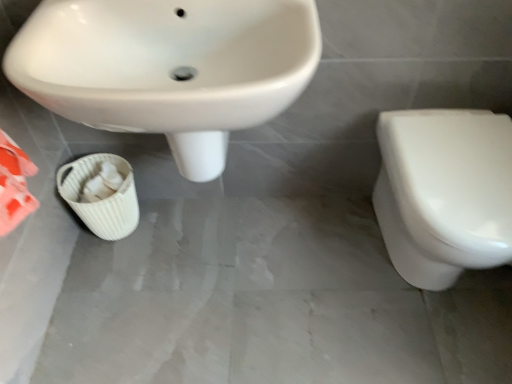
Question: Is white glossy toilet at right oriented towards white woven basket at lower left?

Choices:
 (A) no
 (B) yes

Answer: (A)

Question: Considering the relative positions of white glossy toilet at right and white woven basket at lower left in the image provided, is white glossy toilet at right to the right of white woven basket at lower left from the viewer's perspective?

Choices:
 (A) no
 (B) yes

Answer: (B)

Question: From the image's perspective, is white glossy toilet at right on top of white woven basket at lower left?

Choices:
 (A) yes
 (B) no

Answer: (B)

Question: Is white glossy toilet at right surrounding white woven basket at lower left?

Choices:
 (A) yes
 (B) no

Answer: (B)

Question: Is the surface of white glossy toilet at right in direct contact with white woven basket at lower left?

Choices:
 (A) yes
 (B) no

Answer: (B)

Question: Can you confirm if white glossy toilet at right is taller than white woven basket at lower left?

Choices:
 (A) no
 (B) yes

Answer: (B)

Question: Considering the relative positions of white woven basket at lower left and white glossy toilet at right in the image provided, is white woven basket at lower left to the left of white glossy toilet at right from the viewer's perspective?

Choices:
 (A) yes
 (B) no

Answer: (A)

Question: From the image's perspective, is white woven basket at lower left located above white glossy toilet at right?

Choices:
 (A) no
 (B) yes

Answer: (B)

Question: Does white woven basket at lower left have a greater height compared to white glossy toilet at right?

Choices:
 (A) yes
 (B) no

Answer: (B)

Question: Are white woven basket at lower left and white glossy toilet at right far apart?

Choices:
 (A) no
 (B) yes

Answer: (A)

Question: Can we say white woven basket at lower left lies outside white glossy toilet at right?

Choices:
 (A) yes
 (B) no

Answer: (A)

Question: Is white woven basket at lower left turned away from white glossy toilet at right?

Choices:
 (A) no
 (B) yes

Answer: (A)

Question: From a real-world perspective, is white glossy sink at upper left located higher than white glossy toilet at right?

Choices:
 (A) no
 (B) yes

Answer: (B)